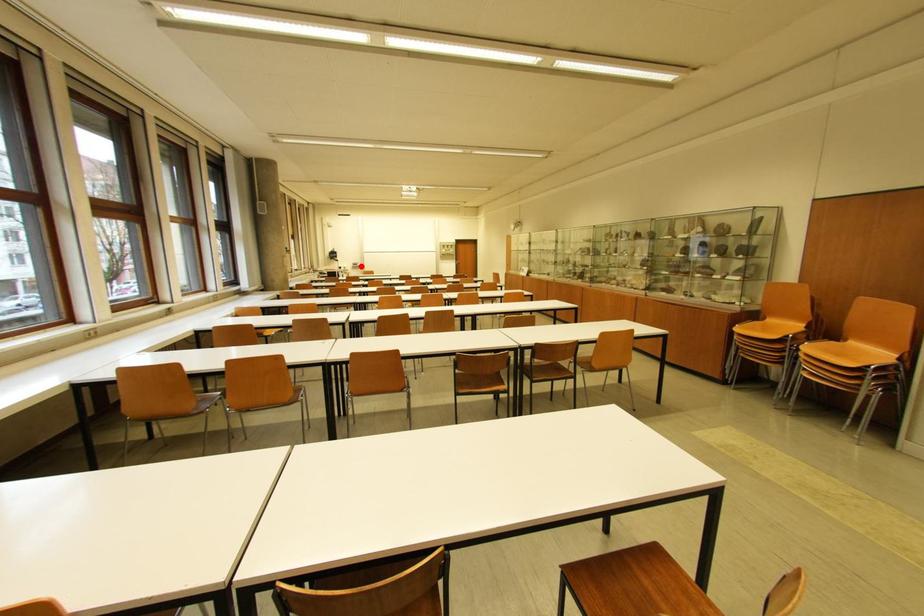
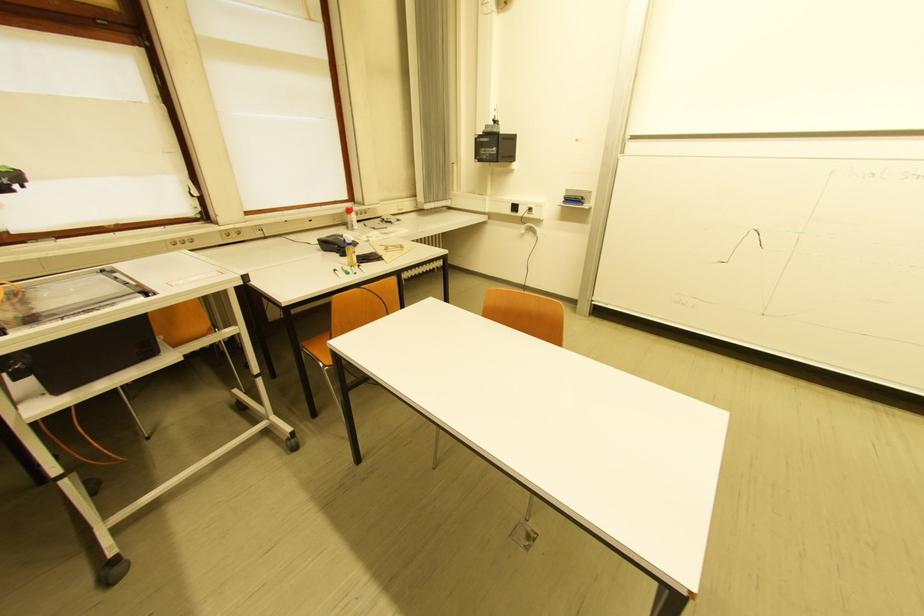
In the second image, find the point that corresponds to the highlighted location in the first image.

(575, 201)